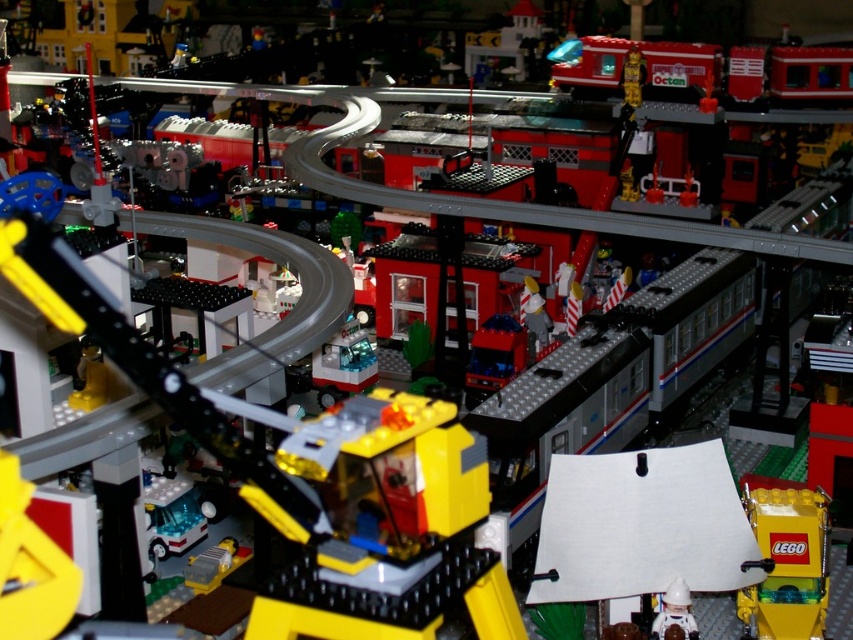
Is yellow matte lego box at lower right positioned at the back of white plastic astronaut at lower right?

Yes, it is behind white plastic astronaut at lower right.

In the scene shown: Does yellow matte lego box at lower right have a greater width compared to white plastic astronaut at lower right?

Correct, the width of yellow matte lego box at lower right exceeds that of white plastic astronaut at lower right.

At what (x,y) coordinates should I click in order to perform the action: click on yellow matte lego box at lower right. Please return your answer as a coordinate pair (x, y). The width and height of the screenshot is (853, 640). Looking at the image, I should click on (787, 564).

Where is `yellow matte lego box at lower right`? yellow matte lego box at lower right is located at coordinates [787, 564].